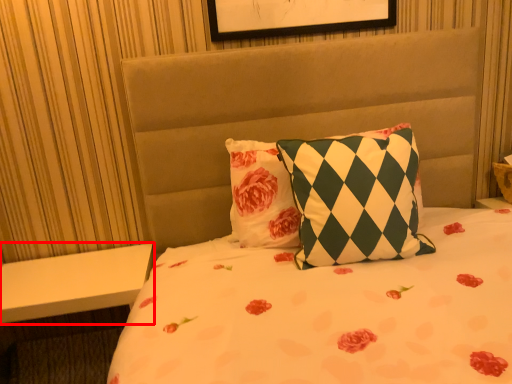
Question: From the image's perspective, what is the correct spatial positioning of table (annotated by the red box) in reference to pillow?

Choices:
 (A) below
 (B) above

Answer: (A)